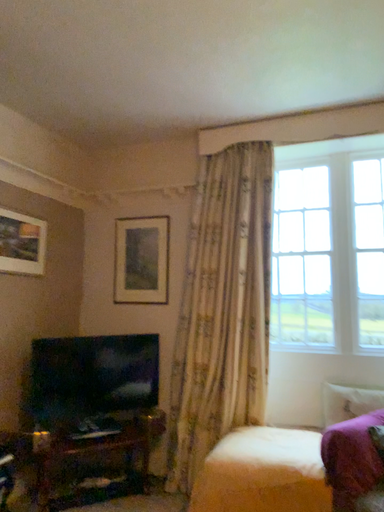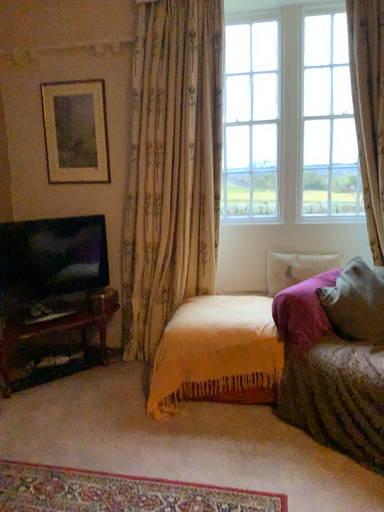
Question: How did the camera likely rotate when shooting the video?

Choices:
 (A) rotated upward
 (B) rotated downward

Answer: (B)